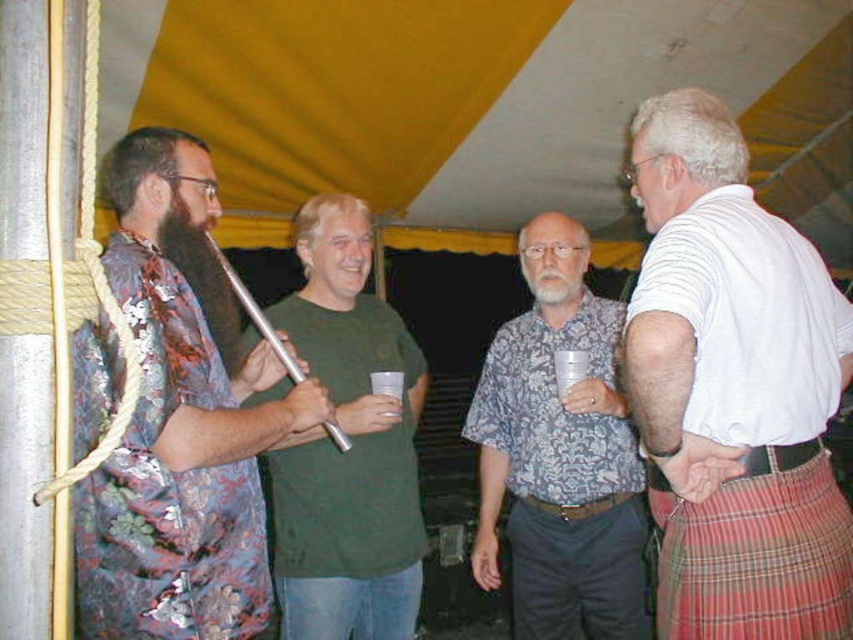
Question: Can you confirm if green matte t-shirt at center is bigger than silver metallic flute at center?

Choices:
 (A) no
 (B) yes

Answer: (B)

Question: Which point appears closest to the camera in this image?

Choices:
 (A) (138, 424)
 (B) (376, 378)
 (C) (379, 636)
 (D) (329, 422)

Answer: (A)

Question: Which of the following is the closest to the observer?

Choices:
 (A) (154, 488)
 (B) (286, 349)

Answer: (A)

Question: Can you confirm if green matte t-shirt at center is positioned to the left of silver metallic flute at center?

Choices:
 (A) yes
 (B) no

Answer: (B)

Question: Which object appears farthest from the camera in this image?

Choices:
 (A) patterned fabric shirt at center
 (B) white plastic cup at center
 (C) green matte t-shirt at center
 (D) silver metallic flute at center

Answer: (B)

Question: Is white cotton shirt at right smaller than green matte t-shirt at center?

Choices:
 (A) no
 (B) yes

Answer: (B)